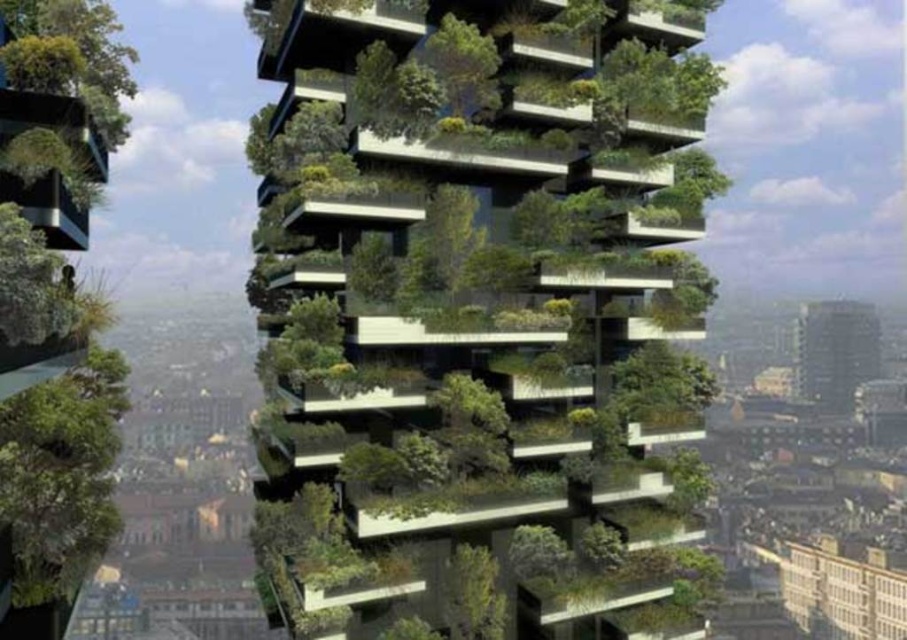
Based on the photo, you are a visitor standing at the base of the building and want to take a photo of both the green matte tree at lower left and the black glass tower at upper right in the same frame. Considering their sizes, which object should you position closer to the center of your camera viewfinder to ensure both are visible?

Since the green matte tree at lower left is smaller than the black glass tower at upper right, you should position the larger black glass tower at upper right closer to the center of your camera viewfinder to ensure both are visible in the frame.